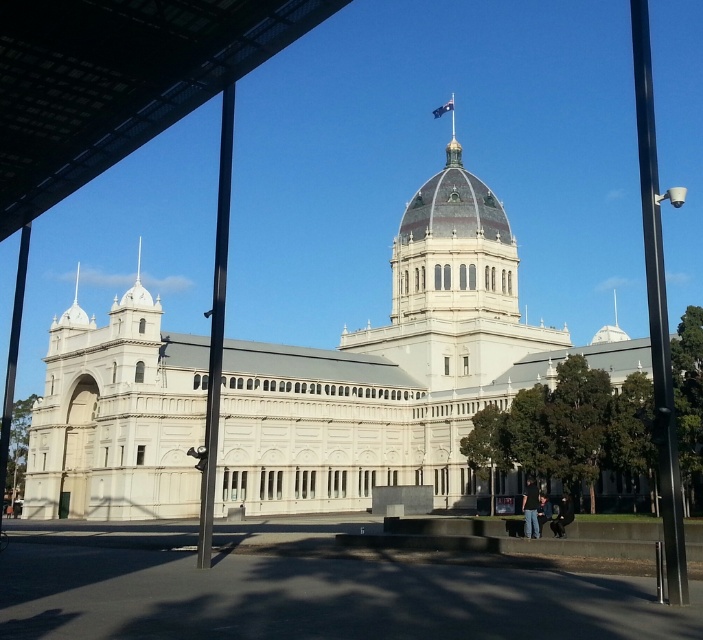
Question: Among these points, which one is nearest to the camera?

Choices:
 (A) (406, 371)
 (B) (77, 99)
 (C) (221, 106)

Answer: (B)

Question: Is black metal pole at center smaller than black metal pole at left?

Choices:
 (A) no
 (B) yes

Answer: (B)

Question: Is black metal pole at right to the left of black metal pole at center from the viewer's perspective?

Choices:
 (A) no
 (B) yes

Answer: (A)

Question: Among these points, which one is farthest from the camera?

Choices:
 (A) (647, 260)
 (B) (467, 177)

Answer: (B)

Question: Which of these objects is positioned closest to the dark gray metal canopy at upper center?

Choices:
 (A) white stone building at center
 (B) black metal pole at left

Answer: (B)

Question: Where is dark gray metal canopy at upper center located in relation to black metal pole at right in the image?

Choices:
 (A) above
 (B) below

Answer: (B)